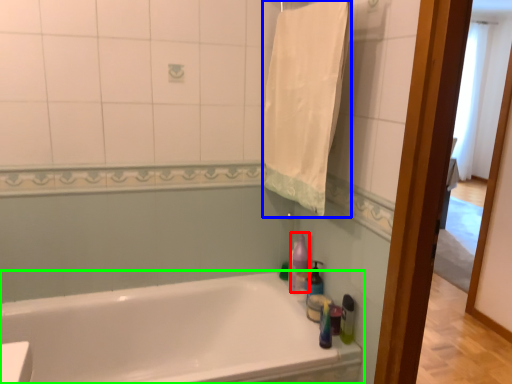
Question: Estimate the real-world distances between objects in this image. Which object is closer to cleaning product (highlighted by a red box), bath towel (highlighted by a blue box) or bathtub (highlighted by a green box)?

Choices:
 (A) bath towel
 (B) bathtub

Answer: (B)